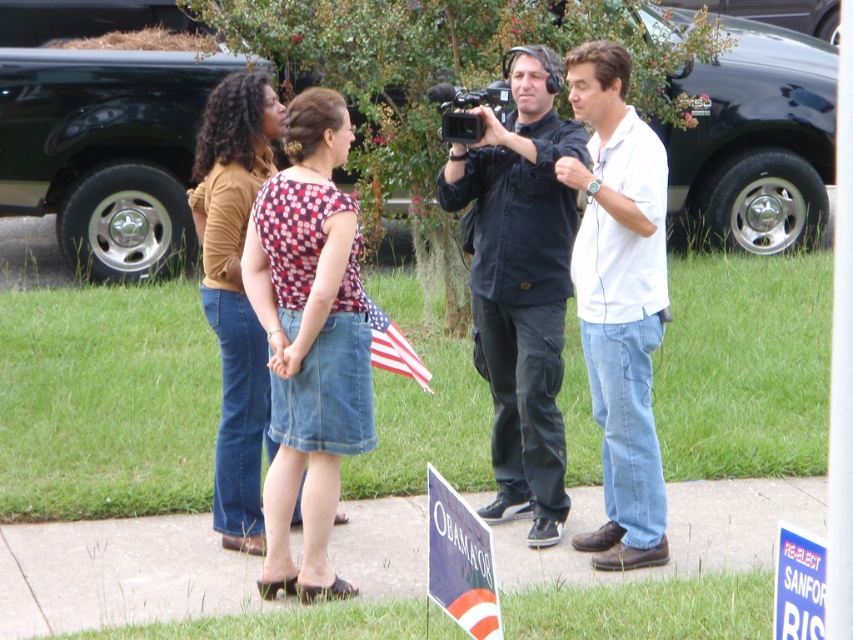
Between black shirt at center and black plastic video camera at center, which one appears on the left side from the viewer's perspective?

From the viewer's perspective, black plastic video camera at center appears more on the left side.

Does point (573, 195) come in front of point (466, 99)?

That is True.

Describe the element at coordinates (520, 282) in the screenshot. I see `black shirt at center` at that location.

The height and width of the screenshot is (640, 853). What are the coordinates of `black shirt at center` in the screenshot? It's located at (520, 282).

What do you see at coordinates (619, 300) in the screenshot? I see `white cotton shirt at center` at bounding box center [619, 300].

Who is positioned more to the left, white cotton shirt at center or american flag at center?

Positioned to the left is american flag at center.

Is point (619, 204) closer to camera compared to point (416, 376)?

Yes, it is.

In order to click on white cotton shirt at center in this screenshot , I will do `click(619, 300)`.

Can you confirm if black shirt at center is bigger than denim skirt at center?

Yes.

Is point (531, 413) farther from viewer compared to point (215, 317)?

Yes, it is behind point (215, 317).

This screenshot has width=853, height=640. I want to click on black shirt at center, so click(520, 282).